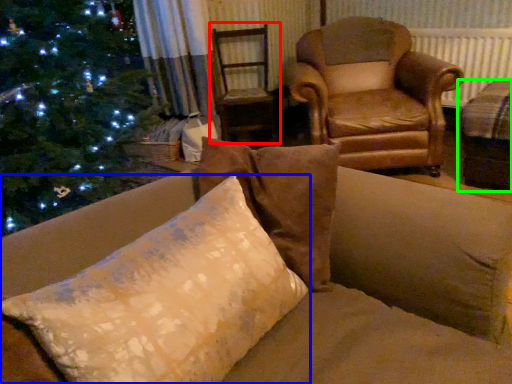
Question: Which object is positioned farthest from swivel chair (highlighted by a red box)? Select from pillow (highlighted by a blue box) and beige (highlighted by a green box).

Choices:
 (A) pillow
 (B) beige

Answer: (A)